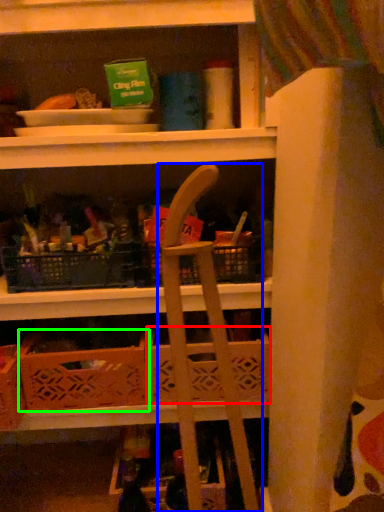
Question: Which object is positioned farthest from basket (highlighted by a red box)? Select from folding chair (highlighted by a blue box) and crate (highlighted by a green box).

Choices:
 (A) folding chair
 (B) crate

Answer: (B)